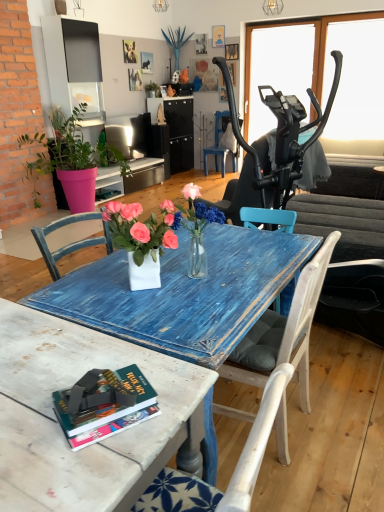
Question: Should I look upward or downward to see hardcover book at lower left?

Choices:
 (A) down
 (B) up

Answer: (A)

Question: Should I look upward or downward to see pink plastic pot at left, the 2th houseplant in the top-to-bottom sequence?

Choices:
 (A) up
 (B) down

Answer: (A)

Question: Is transparent glass window screen at upper right closer to the viewer compared to blue painted wood chair at center, marked as the 1th chair in a top-to-bottom arrangement?

Choices:
 (A) yes
 (B) no

Answer: (A)

Question: Is transparent glass window screen at upper right facing towards blue painted wood chair at center, acting as the second chair starting from the front?

Choices:
 (A) no
 (B) yes

Answer: (A)

Question: Is transparent glass window screen at upper right looking in the opposite direction of blue painted wood chair at center, marked as the 1th chair in a top-to-bottom arrangement?

Choices:
 (A) no
 (B) yes

Answer: (A)

Question: Considering the relative sizes of transparent glass window screen at upper right and blue painted wood chair at center, the second chair positioned from the bottom, in the image provided, is transparent glass window screen at upper right bigger than blue painted wood chair at center, the second chair positioned from the bottom,?

Choices:
 (A) yes
 (B) no

Answer: (B)

Question: Is transparent glass window screen at upper right far away from blue painted wood chair at center, acting as the second chair starting from the front?

Choices:
 (A) no
 (B) yes

Answer: (A)

Question: From the image's perspective, is transparent glass window screen at upper right above blue painted wood chair at center, acting as the 1th chair starting from the back?

Choices:
 (A) no
 (B) yes

Answer: (B)

Question: Considering the relative sizes of blue textured vase at upper center and blue painted wood chair at center, the second chair positioned from the bottom, in the image provided, is blue textured vase at upper center bigger than blue painted wood chair at center, the second chair positioned from the bottom,?

Choices:
 (A) yes
 (B) no

Answer: (B)

Question: Considering the relative positions of blue textured vase at upper center and blue painted wood chair at center, acting as the 1th chair starting from the back, in the image provided, is blue textured vase at upper center to the left of blue painted wood chair at center, acting as the 1th chair starting from the back, from the viewer's perspective?

Choices:
 (A) yes
 (B) no

Answer: (A)

Question: Can you confirm if blue textured vase at upper center is thinner than blue painted wood chair at center, acting as the 1th chair starting from the back?

Choices:
 (A) yes
 (B) no

Answer: (A)

Question: Does blue textured vase at upper center appear on the right side of blue painted wood chair at center, the second chair positioned from the bottom?

Choices:
 (A) no
 (B) yes

Answer: (A)

Question: From the image's perspective, is blue textured vase at upper center over blue painted wood chair at center, marked as the 1th chair in a top-to-bottom arrangement?

Choices:
 (A) yes
 (B) no

Answer: (A)

Question: Does blue textured vase at upper center have a smaller size compared to blue painted wood chair at center, acting as the second chair starting from the front?

Choices:
 (A) no
 (B) yes

Answer: (B)

Question: Can you see green matte plant at upper center, acting as the first houseplant starting from the top, touching white glossy vase at center?

Choices:
 (A) no
 (B) yes

Answer: (A)